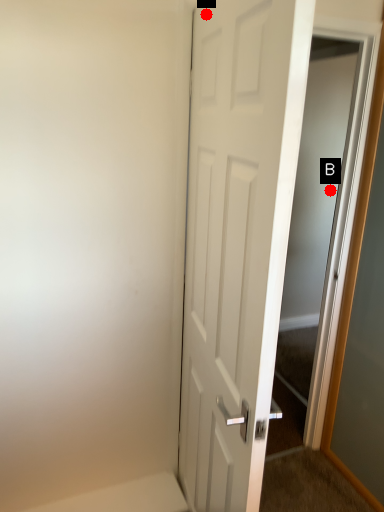
Question: Two points are circled on the image, labeled by A and B beside each circle. Which point appears farthest from the camera in this image?

Choices:
 (A) A is further
 (B) B is further

Answer: (B)